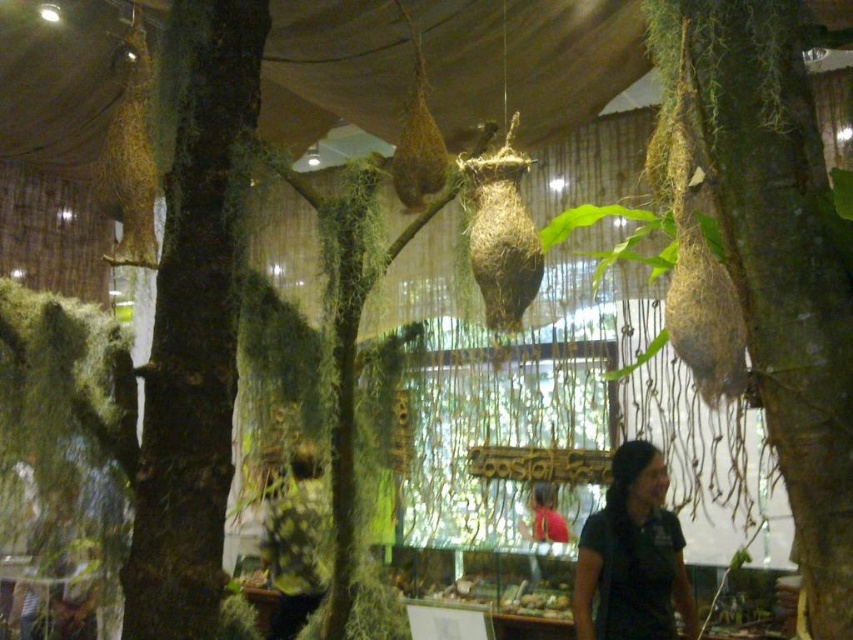
Question: Can you confirm if black matte shirt at lower right is wider than dark brown leather shirt at lower center?

Choices:
 (A) yes
 (B) no

Answer: (A)

Question: Which object is the farthest from the green mossy tree at center?

Choices:
 (A) black matte shirt at lower right
 (B) dark brown bark at center

Answer: (A)

Question: Does dark brown bark at center appear on the right side of dark brown leather shirt at lower center?

Choices:
 (A) no
 (B) yes

Answer: (B)

Question: Is the position of dark brown bark at center more distant than that of black matte shirt at lower right?

Choices:
 (A) yes
 (B) no

Answer: (B)

Question: Considering the real-world distances, which object is farthest from the green mossy tree at center?

Choices:
 (A) dark brown bark at center
 (B) dark brown leather shirt at lower center
 (C) black matte shirt at lower right

Answer: (B)

Question: Which of the following is the farthest from the observer?

Choices:
 (A) (616, 604)
 (B) (288, 518)
 (C) (717, 49)
 (D) (187, 202)

Answer: (B)